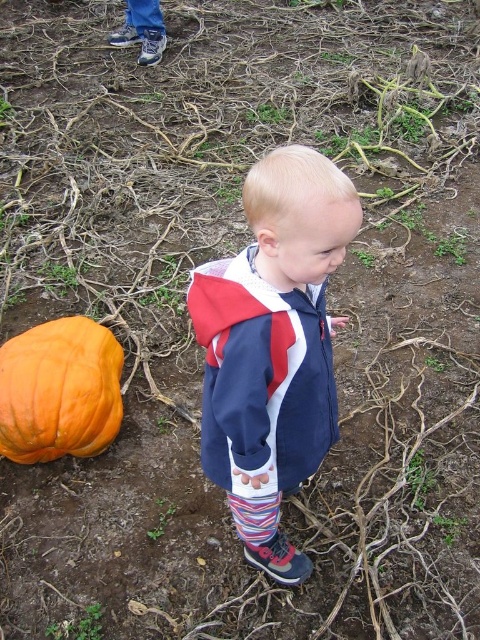
You are a photographer trying to capture the child in the garden. You want to position yourself so that the orange matte pumpkin at lower left is visible in the frame while ensuring the navy blue jacket at center is centered. Based on their positions, where should you stand relative to the child?

You should stand to the left of the child so that the navy blue jacket at center is centered and the orange matte pumpkin at lower left remains visible in the frame.

You are a photographer trying to capture a clear shot of the orange matte pumpkin at lower left without the navy blue jacket at center blocking it. Based on their positions, can you adjust your camera angle to achieve this?

The navy blue jacket at center is positioned over the orange matte pumpkin at lower left, so adjusting the camera angle downward or moving to the side could help avoid the jacket blocking the pumpkin.

You are a photographer trying to capture the child in the scene. Since the navy blue jacket at center and the orange matte pumpkin at lower left are both in view, which object should you focus on to ensure the child is in focus?

The navy blue jacket at center is much taller than the orange matte pumpkin at lower left, so focusing on the navy blue jacket at center will ensure the child is in focus because it is closer to the child.